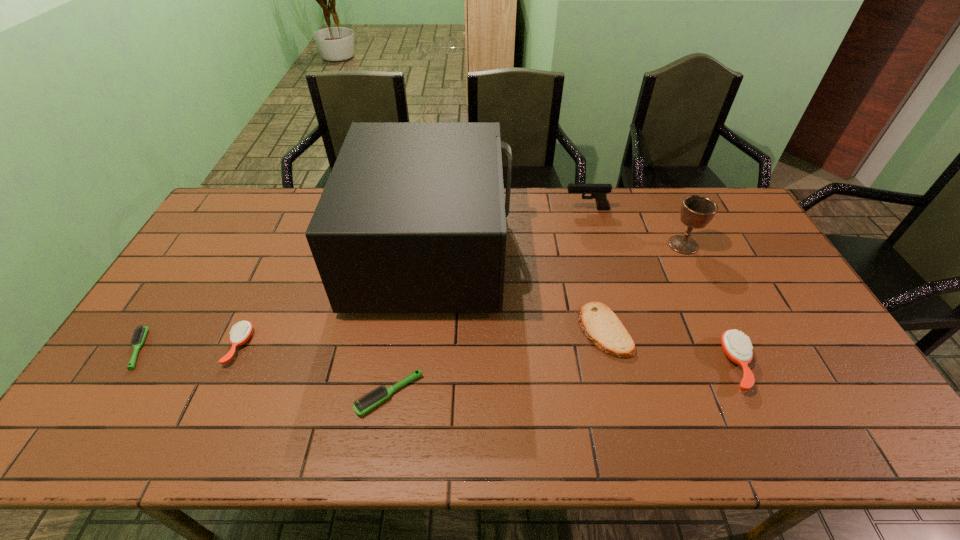
Identify the location of vacant space at the near right corner. This screenshot has width=960, height=540. (847, 449).

Locate an element on the screen. blank region between the chalice and the third tallest hairbrush is located at coordinates (537, 319).

Where is `empty space between the bigger orange hairbrush and the third tallest object`? empty space between the bigger orange hairbrush and the third tallest object is located at coordinates (662, 287).

Where is `vacant region between the second hairbrush from right to left and the tallest object`? This screenshot has height=540, width=960. vacant region between the second hairbrush from right to left and the tallest object is located at coordinates (x=411, y=323).

At what (x,y) coordinates should I click in order to perform the action: click on empty space that is in between the right orange hairbrush and the third tallest object. Please return your answer as a coordinate pair (x, y). Image resolution: width=960 pixels, height=540 pixels. Looking at the image, I should click on (662, 287).

Where is `vacant space in between the second tallest object and the rightmost hairbrush`? vacant space in between the second tallest object and the rightmost hairbrush is located at coordinates (710, 305).

The height and width of the screenshot is (540, 960). Find the location of `vacant area that lies between the nearer light hairbrush and the smaller orange hairbrush`. vacant area that lies between the nearer light hairbrush and the smaller orange hairbrush is located at coordinates (315, 370).

This screenshot has height=540, width=960. Identify the location of free space between the third hairbrush from left to right and the smaller light hairbrush. (264, 372).

Choose which object is the third nearest neighbor to the second shortest hairbrush. Please provide its 2D coordinates. Your answer should be formatted as a tuple, i.e. [(x, y)], where the tuple contains the x and y coordinates of a point satisfying the conditions above.

[(599, 323)]

Where is `object that can be found as the closest to the chalice`? The width and height of the screenshot is (960, 540). object that can be found as the closest to the chalice is located at coordinates (599, 192).